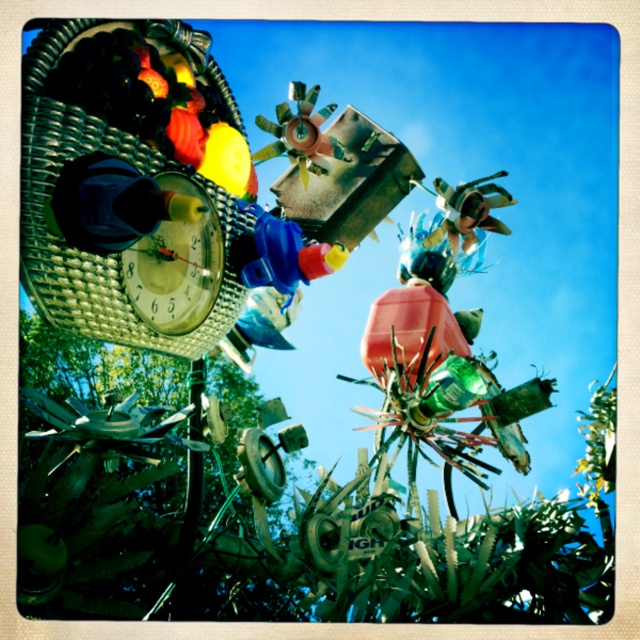
You are standing in front of the art installation and want to locate the blue plastic toy at center. According to the coordinates provided, where exactly would you find it?

The blue plastic toy at center is located at point coordinates of (x=285, y=253).

You are standing in front of the art installation and want to take a photo of the metallic clock at upper left. Where should you position yourself to capture it in the frame?

To capture the metallic clock at upper left in your photo, position yourself so that the camera is aimed at the coordinates point (177, 264) where the metallic clock at upper left is located.